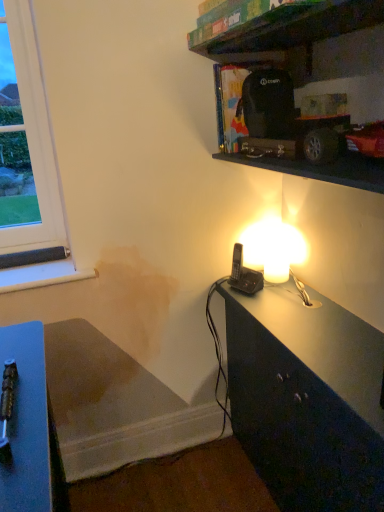
Question: From the image's perspective, relative to black plastic phone at right, is wooden bookshelf at upper center above or below?

Choices:
 (A) above
 (B) below

Answer: (A)

Question: Looking at their shapes, would you say wooden bookshelf at upper center is wider or thinner than black plastic phone at right?

Choices:
 (A) thin
 (B) wide

Answer: (B)

Question: Is wooden bookshelf at upper center taller or shorter than black plastic phone at right?

Choices:
 (A) tall
 (B) short

Answer: (B)

Question: Does point (259, 288) appear closer or farther from the camera than point (319, 35)?

Choices:
 (A) farther
 (B) closer

Answer: (A)

Question: Relative to wooden bookshelf at upper center, is black plastic phone at right in front or behind?

Choices:
 (A) front
 (B) behind

Answer: (B)

Question: Based on their sizes in the image, would you say black plastic phone at right is bigger or smaller than wooden bookshelf at upper center?

Choices:
 (A) small
 (B) big

Answer: (A)

Question: Looking at their shapes, would you say black plastic phone at right is wider or thinner than wooden bookshelf at upper center?

Choices:
 (A) wide
 (B) thin

Answer: (B)